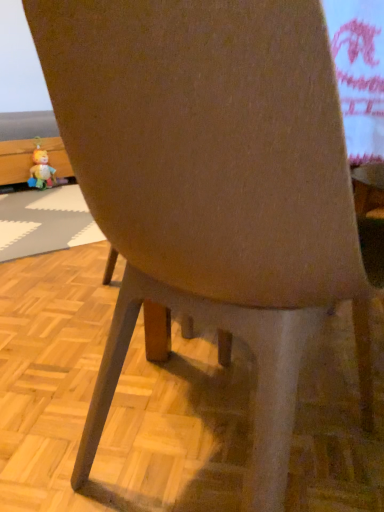
Question: Based on their positions, is plush yellow toy at left located to the left or right of white rubber place mat at lower left?

Choices:
 (A) right
 (B) left

Answer: (B)

Question: From a real-world perspective, relative to white rubber place mat at lower left, is plush yellow toy at left vertically above or below?

Choices:
 (A) below
 (B) above

Answer: (B)

Question: Considering their positions, is plush yellow toy at left located in front of or behind white rubber place mat at lower left?

Choices:
 (A) front
 (B) behind

Answer: (B)

Question: Is white rubber place mat at lower left to the left or to the right of plush yellow toy at left in the image?

Choices:
 (A) left
 (B) right

Answer: (B)

Question: From the image's perspective, is white rubber place mat at lower left positioned above or below plush yellow toy at left?

Choices:
 (A) below
 (B) above

Answer: (A)

Question: Looking at the image, does white rubber place mat at lower left seem bigger or smaller compared to plush yellow toy at left?

Choices:
 (A) big
 (B) small

Answer: (A)

Question: Considering the positions of white rubber place mat at lower left and plush yellow toy at left in the image, is white rubber place mat at lower left wider or thinner than plush yellow toy at left?

Choices:
 (A) thin
 (B) wide

Answer: (B)